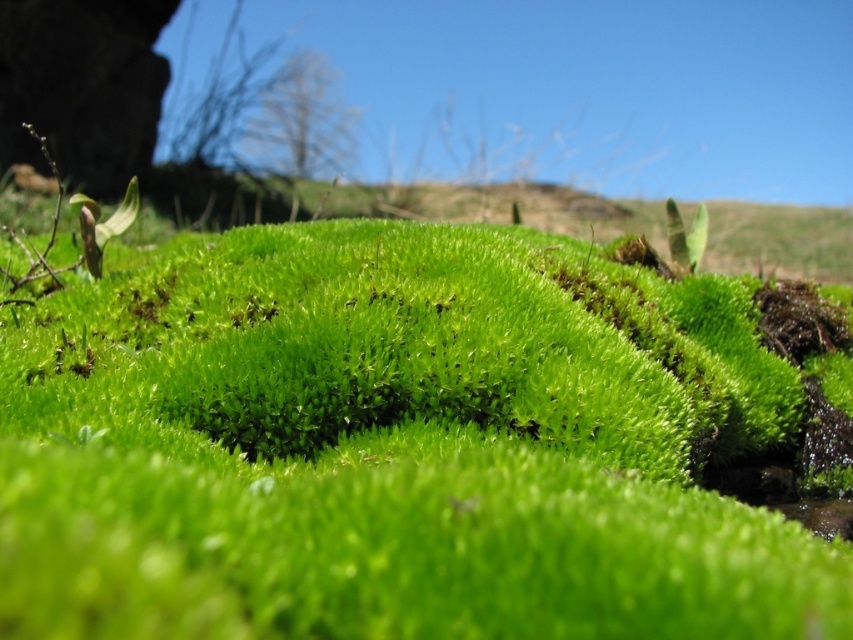
You are a gardener who wants to plant a new flower between the green soft moss at center and the green fuzzy moss at center. What is the minimum distance you need to maintain between the two mosses to ensure the flower can fit?

The distance between the green soft moss at center and the green fuzzy moss at center is 1.56 meters. To plant the flower between them, the minimum distance required is 1.56 meters.

You are a gardener examining a garden bed and notice two types of moss growing in the center. You see the green soft moss at center and the green fuzzy moss at center. Which one has a greater width?

The green soft moss at center has a greater width than the green fuzzy moss at center.

You are a botanist studying moss growth. You observe two types of moss in the image, the green soft moss at center and the green fuzzy moss at center. Which one is taller?

The green soft moss at center has a greater height compared to the green fuzzy moss at center.